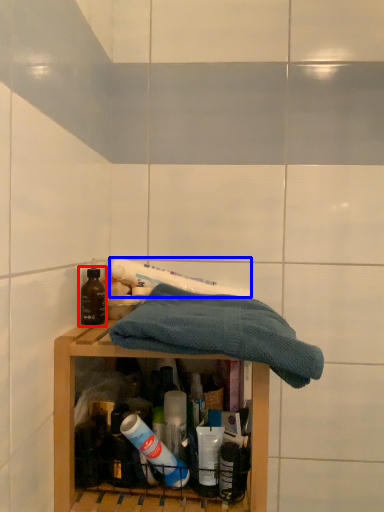
Question: Which of the following is the farthest to the observer, bottle (highlighted by a red box) or toothpaste (highlighted by a blue box)?

Choices:
 (A) bottle
 (B) toothpaste

Answer: (B)